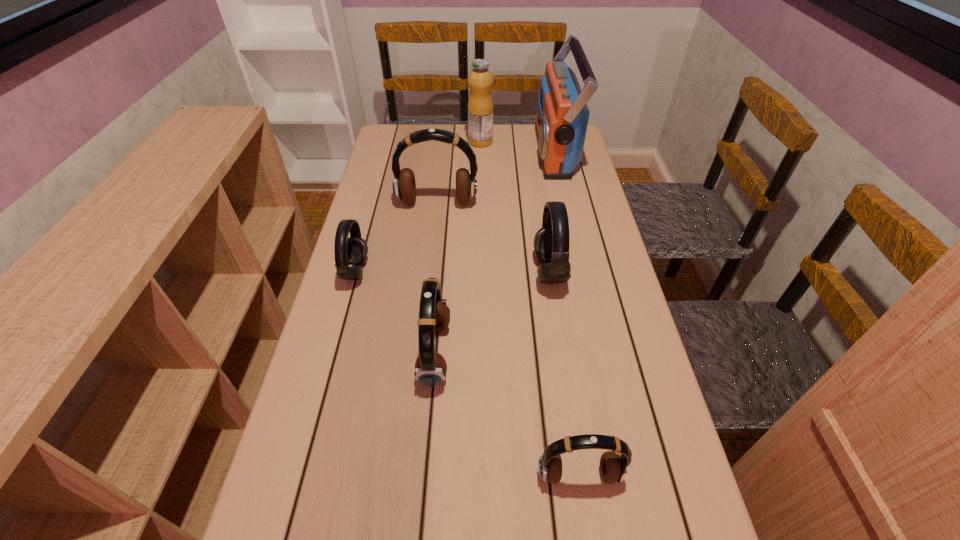
Where is `blue radio receiver`? blue radio receiver is located at coordinates (562, 117).

Find the location of a particular element. The height and width of the screenshot is (540, 960). fruit juice is located at coordinates (480, 80).

Find the location of a particular element. The height and width of the screenshot is (540, 960). the biggest brown headset is located at coordinates (404, 186).

Locate an element on the screen. the farthest headset is located at coordinates (404, 186).

Find the location of a particular element. This screenshot has width=960, height=540. the right gray headset is located at coordinates (551, 242).

Identify the location of the second farthest brown headset. The width and height of the screenshot is (960, 540). (434, 315).

Locate an element on the screen. the second nearest object is located at coordinates (434, 315).

What are the coordinates of `the leftmost headset` in the screenshot? It's located at (350, 253).

You are a GUI agent. You are given a task and a screenshot of the screen. Output one action in this format:
    pyautogui.click(x=<x>, y=<y>)
    Task: Click on the smaller gray headset
    
    Given the screenshot: What is the action you would take?
    pyautogui.click(x=350, y=253)

I want to click on the smallest brown headset, so click(613, 466).